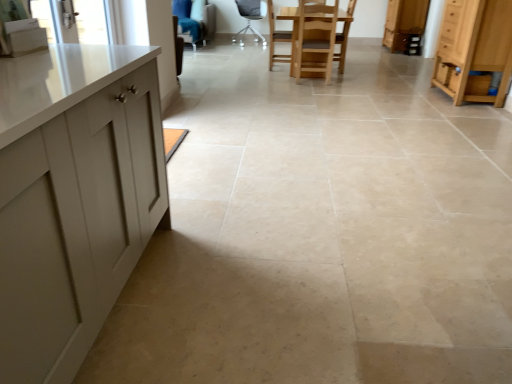
Question: From the image's perspective, does light blue fabric armchair at upper center, arranged as the first armchair when viewed from the left, appear higher than metallic gray chair at center, positioned as the 1th chair in top-to-bottom order?

Choices:
 (A) yes
 (B) no

Answer: (B)

Question: Does light blue fabric armchair at upper center, which is the second armchair in front-to-back order, have a larger size compared to metallic gray chair at center, positioned as the 1th chair in top-to-bottom order?

Choices:
 (A) yes
 (B) no

Answer: (A)

Question: Is light blue fabric armchair at upper center, marked as the 2th armchair in a right-to-left arrangement, thinner than metallic gray chair at center, positioned as the 1th chair in top-to-bottom order?

Choices:
 (A) yes
 (B) no

Answer: (B)

Question: Does light blue fabric armchair at upper center, marked as the 2th armchair in a right-to-left arrangement, have a lesser height compared to metallic gray chair at center, which is the first chair in back-to-front order?

Choices:
 (A) yes
 (B) no

Answer: (A)

Question: From the image's perspective, is light blue fabric armchair at upper center, which is the second armchair in front-to-back order, located beneath metallic gray chair at center, the second chair viewed from the front?

Choices:
 (A) no
 (B) yes

Answer: (B)

Question: Is wooden cabinet at upper right, which is the second cabinetry in bottom-to-top order, inside the boundaries of wooden chair at center, the first chair positioned from the right, or outside?

Choices:
 (A) outside
 (B) inside

Answer: (A)

Question: From the image's perspective, is wooden cabinet at upper right, the 2th cabinetry from the front, located above or below wooden chair at center, the first chair positioned from the right?

Choices:
 (A) above
 (B) below

Answer: (A)

Question: In the image, is wooden cabinet at upper right, which is the second cabinetry in bottom-to-top order, positioned in front of or behind wooden chair at center, which is the first chair from bottom to top?

Choices:
 (A) front
 (B) behind

Answer: (B)

Question: Considering the positions of wooden cabinet at upper right, the 1th cabinetry when ordered from top to bottom, and wooden chair at center, which is the first chair from bottom to top, in the image, is wooden cabinet at upper right, the 1th cabinetry when ordered from top to bottom, taller or shorter than wooden chair at center, which is the first chair from bottom to top,?

Choices:
 (A) tall
 (B) short

Answer: (A)

Question: Considering the positions of wooden chair at center, arranged as the second chair when viewed from the back, and wooden chair at center, which is the second armchair in back-to-front order, in the image, is wooden chair at center, arranged as the second chair when viewed from the back, taller or shorter than wooden chair at center, which is the second armchair in back-to-front order,?

Choices:
 (A) short
 (B) tall

Answer: (A)

Question: Is point (271, 31) closer or farther from the camera than point (287, 38)?

Choices:
 (A) farther
 (B) closer

Answer: (B)

Question: In terms of width, does wooden chair at center, which is the 2th chair from top to bottom, look wider or thinner when compared to wooden chair at center, the first armchair viewed from the right?

Choices:
 (A) thin
 (B) wide

Answer: (B)

Question: Choose the correct answer: Is wooden chair at center, arranged as the second chair when viewed from the back, inside wooden chair at center, the first armchair viewed from the right, or outside it?

Choices:
 (A) outside
 (B) inside

Answer: (A)

Question: Based on their positions, is light blue fabric armchair at upper center, arranged as the 1th armchair when viewed from the back, located to the left or right of wooden cabinet at upper right, which is the second cabinetry in bottom-to-top order?

Choices:
 (A) left
 (B) right

Answer: (A)

Question: Considering the positions of light blue fabric armchair at upper center, which is the second armchair in front-to-back order, and wooden cabinet at upper right, the 1th cabinetry when ordered from top to bottom, in the image, is light blue fabric armchair at upper center, which is the second armchair in front-to-back order, bigger or smaller than wooden cabinet at upper right, the 1th cabinetry when ordered from top to bottom,?

Choices:
 (A) small
 (B) big

Answer: (B)